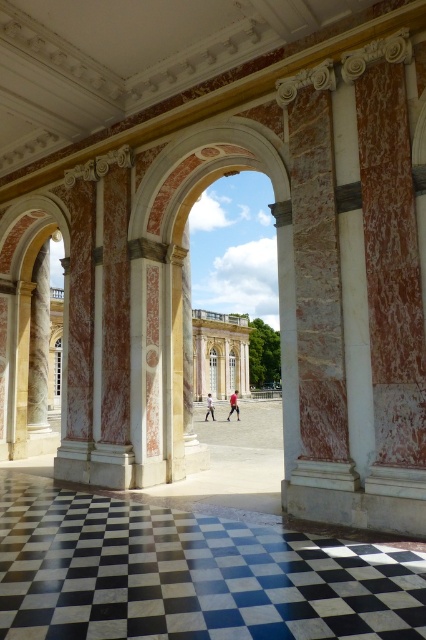
Question: Based on their relative distances, which object is nearer to the light brown leather jacket at center?

Choices:
 (A) black marble floor at center
 (B) red fabric pants at center

Answer: (B)

Question: Which of the following is the closest to the observer?

Choices:
 (A) (238, 406)
 (B) (210, 404)
 (C) (94, 524)

Answer: (C)

Question: Does black marble floor at center have a smaller size compared to red fabric pants at center?

Choices:
 (A) no
 (B) yes

Answer: (B)

Question: Which object appears closest to the camera in this image?

Choices:
 (A) black marble floor at center
 (B) red fabric pants at center
 (C) light brown leather jacket at center

Answer: (A)

Question: Can you confirm if red fabric pants at center is thinner than light brown leather jacket at center?

Choices:
 (A) yes
 (B) no

Answer: (B)

Question: Does black marble floor at center appear on the left side of red fabric pants at center?

Choices:
 (A) no
 (B) yes

Answer: (B)